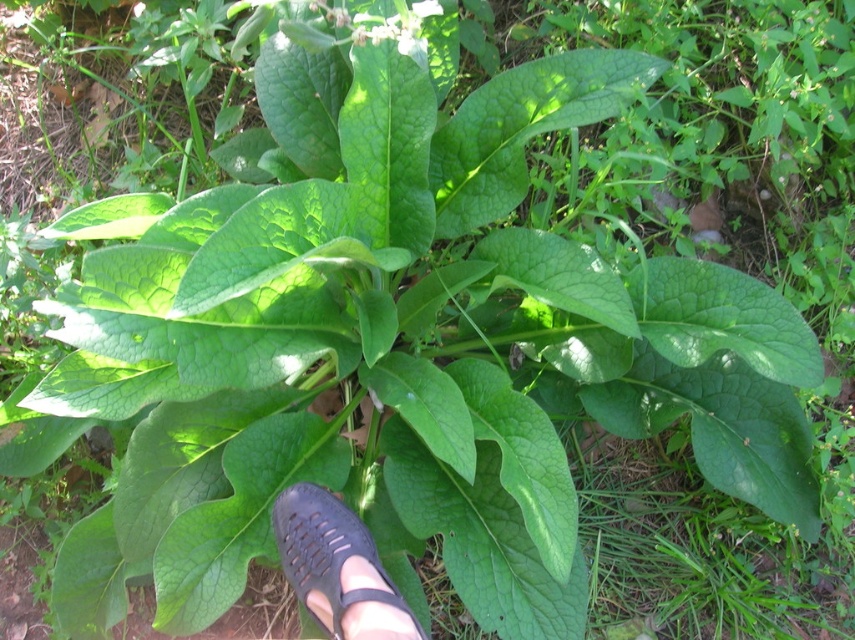
You are a gardener who needs to water the green matte flower at upper center without getting the black mesh shoe at center wet. Can you reach the flower with a watering can from your current position?

The distance between the black mesh shoe at center and the green matte flower at upper center is 80.24 centimeters. Since the shoe is near the plant base, you can likely water the flower without wetting the shoe by carefully directing the stream from 80.24 cm away.

You are a gardener who wants to water the plant without getting the black mesh shoe at center wet. Where should you avoid spraying water?

You should avoid spraying water near the black mesh shoe at center located at point (337,566) to prevent it from getting wet.